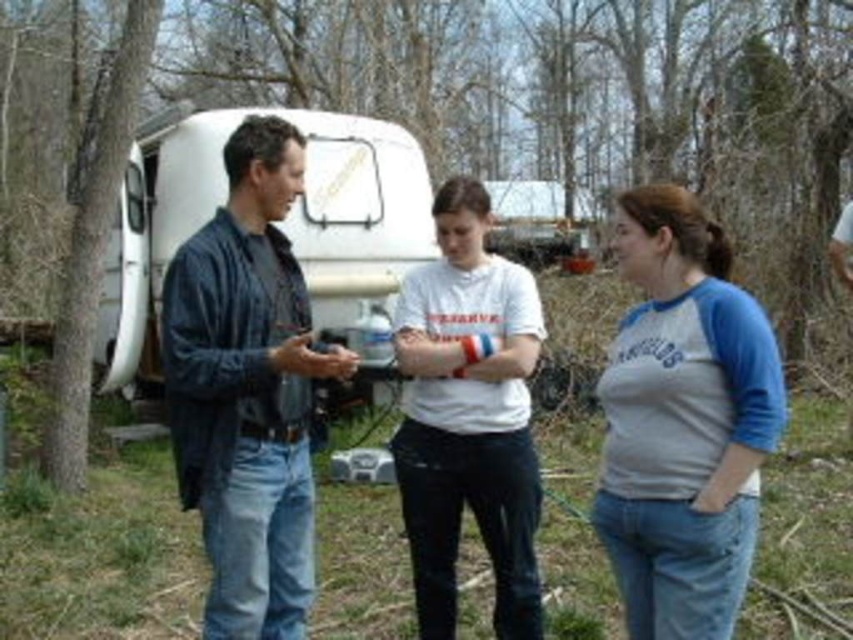
Question: Is denim jacket at center bigger than white matte recreational vehicle at center?

Choices:
 (A) yes
 (B) no

Answer: (B)

Question: Which is nearer to the white matte recreational vehicle at center?

Choices:
 (A) gray cotton shirt at center
 (B) white matte t-shirt at center
 (C) denim jacket at center

Answer: (B)

Question: Estimate the real-world distances between objects in this image. Which object is closer to the denim jacket at center?

Choices:
 (A) white matte recreational vehicle at center
 (B) white matte t-shirt at center

Answer: (B)

Question: Is gray cotton shirt at center above white matte recreational vehicle at center?

Choices:
 (A) yes
 (B) no

Answer: (B)

Question: Is white matte t-shirt at center wider than white matte recreational vehicle at center?

Choices:
 (A) yes
 (B) no

Answer: (B)

Question: Which point is closer to the camera?

Choices:
 (A) denim jacket at center
 (B) white matte t-shirt at center
 (C) gray cotton shirt at center
 (D) white matte recreational vehicle at center

Answer: (C)